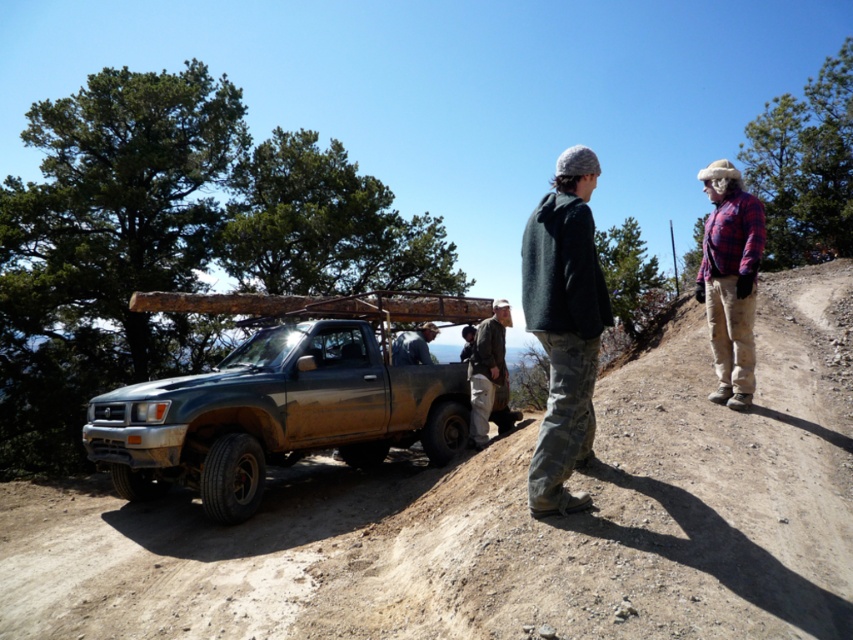
You are a hiker who wants to take a photo of the brown canvas jacket at center and the dirty metallic pickup truck at center. Which object should you focus on first if you want both to be in clear focus?

The dirty metallic pickup truck at center is in front of the brown canvas jacket at center. To have both in clear focus, you should focus on the brown canvas jacket at center first because it is farther away from you, ensuring the pickup truck also stays in focus.

You are a hiker who needs to load a heavy backpack onto the dirty metallic pickup truck at center. Since the truck bed is elevated, you need to use the brown canvas jacket at center as a makeshift step. Is the jacket positioned in a way that allows you to step on it to reach the truck bed?

The dirty metallic pickup truck at center is positioned under the brown canvas jacket at center, meaning the jacket is above the truck. This placement would make it difficult to use the jacket as a step since it is not near the truck bed. You may need to find another object for support.